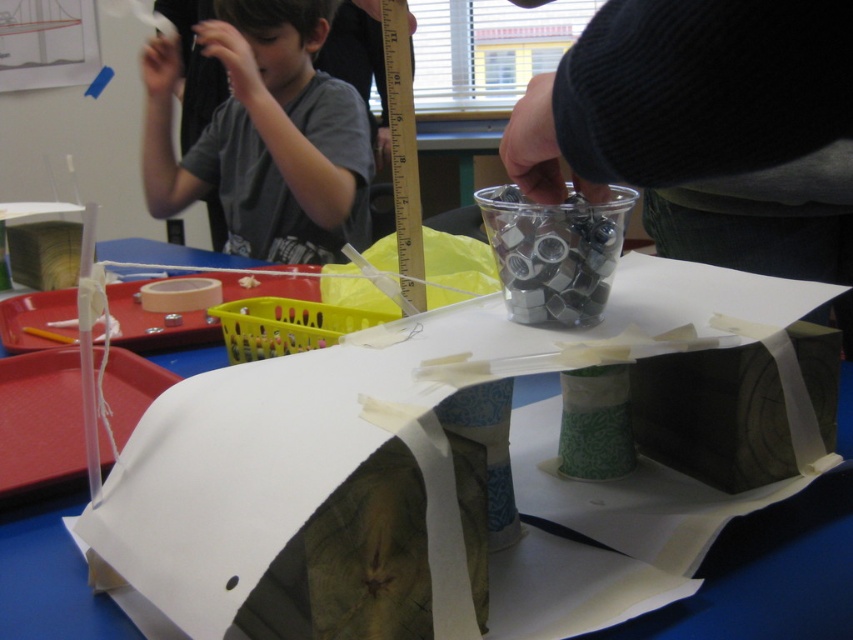
You are organizing a craft fair and need to arrange items on a table. You have a gray cotton shirt at upper left and a matte pink tape at left. If the table is 1 meter wide, can both items fit side by side without overlapping?

The gray cotton shirt at upper left and matte pink tape at left are 69.89 centimeters apart from each other. Since the table is 1 meter wide, which is 100 centimeters, there is enough space to place both items side by side without overlapping as 69.89 cm is less than 100 cm.